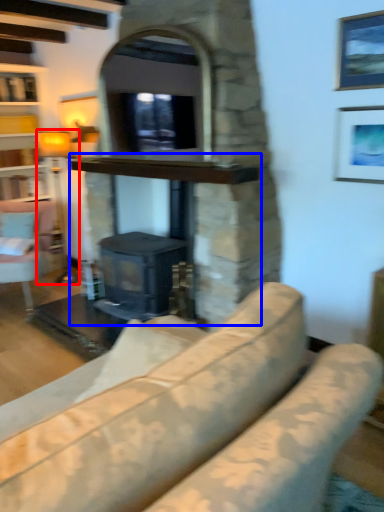
Question: Which point is further to the camera, lamp (highlighted by a red box) or fireplace (highlighted by a blue box)?

Choices:
 (A) lamp
 (B) fireplace

Answer: (A)